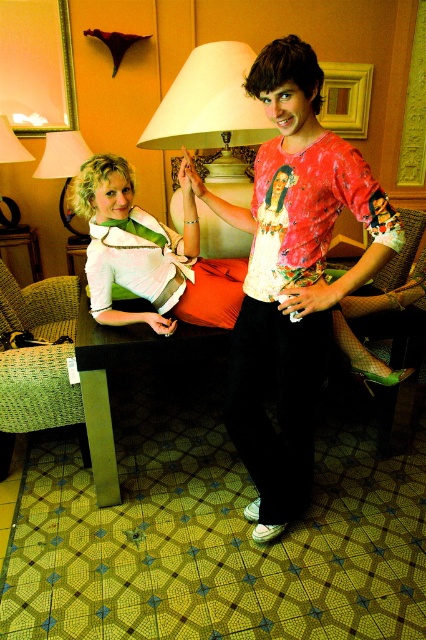
Between matte green blouse at center and velvet orange pillow at center, which one is positioned higher?

matte green blouse at center

Who is more distant from viewer, (184,166) or (236,292)?

The point (236,292) is behind.

Between point (100, 189) and point (206, 282), which one is positioned in front?

Point (100, 189) is in front.

At what (x,y) coordinates should I click in order to perform the action: click on matte green blouse at center. Please return your answer as a coordinate pair (x, y). The width and height of the screenshot is (426, 640). Looking at the image, I should click on (132, 243).

Is green wicker armchair at left behind matte white lampshade at upper center?

No, it is not.

Who is shorter, green wicker armchair at left or matte white lampshade at upper center?

With less height is matte white lampshade at upper center.

This screenshot has height=640, width=426. I want to click on green wicker armchair at left, so click(37, 358).

Is matte red shirt at center wider than white fabric lampshade at center?

Correct, the width of matte red shirt at center exceeds that of white fabric lampshade at center.

What do you see at coordinates (291, 275) in the screenshot? I see `matte red shirt at center` at bounding box center [291, 275].

Where is `matte red shirt at center`? The width and height of the screenshot is (426, 640). matte red shirt at center is located at coordinates (291, 275).